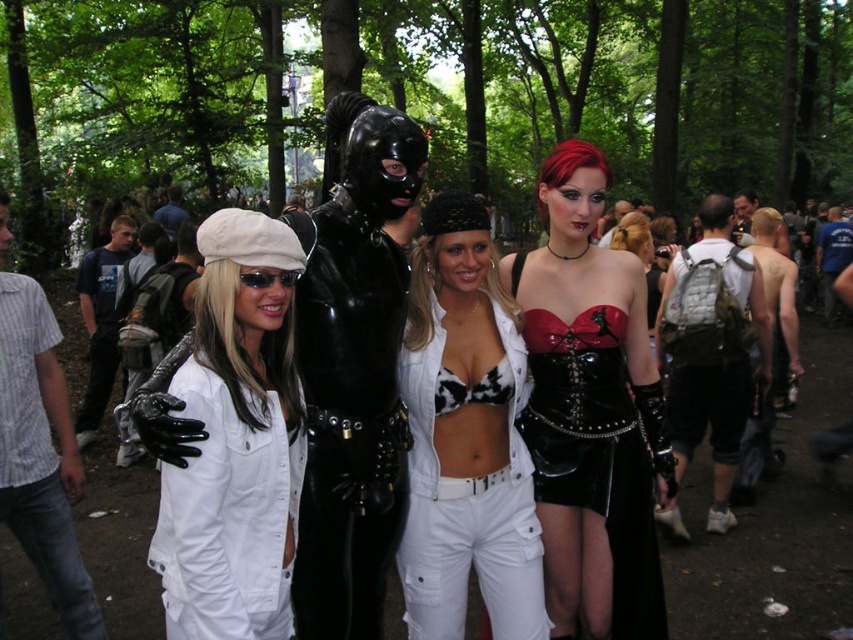
You are a photographer trying to capture a group photo of the white matte jumpsuit at center and the cow print bra at center. Since you want to ensure both subjects are in focus, you need to know which one is closer to the camera. Based on the scene description, which subject is closer?

The white matte jumpsuit at center is thinner than the cow print bra at center, so the white matte jumpsuit at center is closer to the camera.

You are a photographer at the festival and want to capture both the white matte jumpsuit at center and the cow print bra at center in the same frame. Which one should you adjust your camera angle to focus on first to ensure both are visible?

The white matte jumpsuit at center is not as tall as the cow print bra at center, so you should focus on the cow print bra at center first to ensure both are visible in the frame.

You are standing in the middle of the festival crowd and want to know which of the two points, point [567,275] or point [631,236], is closer to you. Which one is it?

Point [567,275] is closer to the viewer than point [631,236].